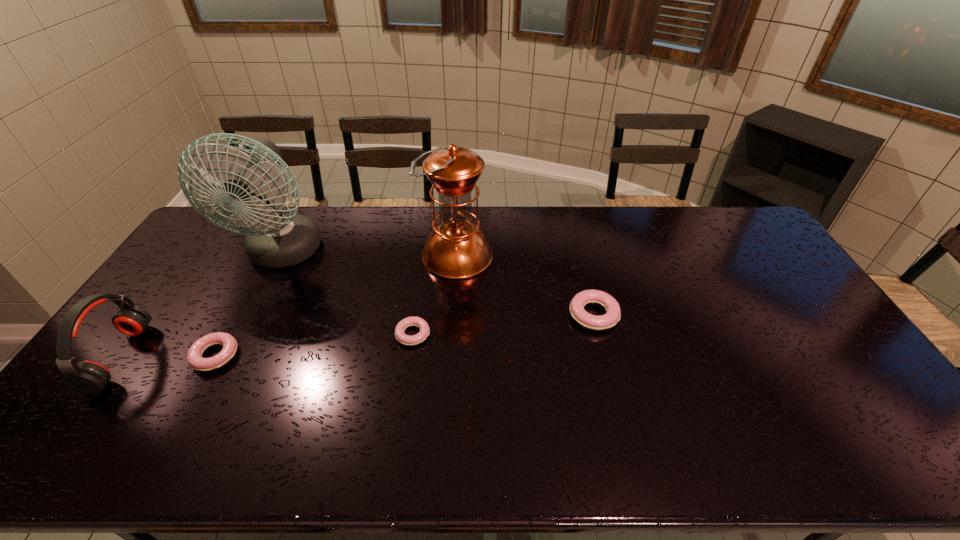
Observe the arrangement of all doughnuts in the image. To keep them evenly spaced, where would you place another doughnut on the right? Please locate a free space. Please provide its 2D coordinates. Your answer should be formatted as a tuple, i.e. [(x, y)], where the tuple contains the x and y coordinates of a point satisfying the conditions above.

[(760, 297)]